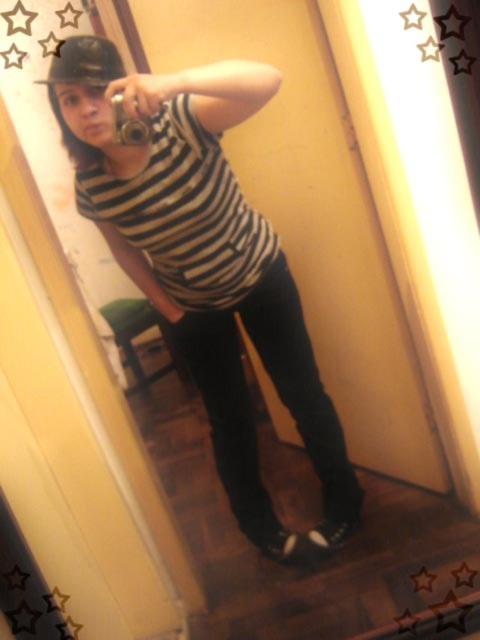
Can you confirm if striped fabric shirt at center is positioned below black matte baseball hat at upper left?

Yes.

The image size is (480, 640). What do you see at coordinates (210, 269) in the screenshot?
I see `striped fabric shirt at center` at bounding box center [210, 269].

The height and width of the screenshot is (640, 480). In order to click on striped fabric shirt at center in this screenshot , I will do `click(210, 269)`.